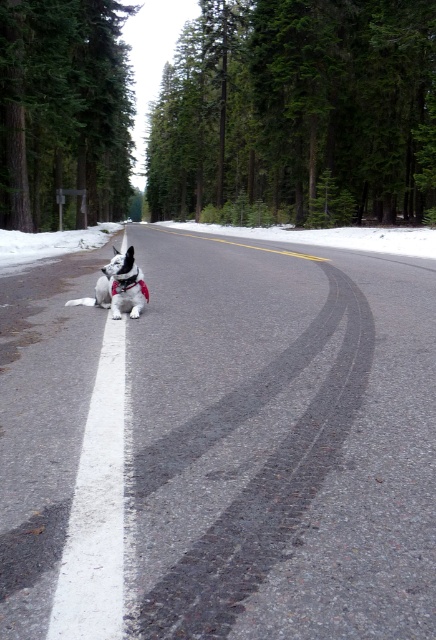
Question: Which of the following is the closest to the observer?

Choices:
 (A) white fur dog at center
 (B) white powdery snow at left
 (C) white powdery snow at road center

Answer: (A)

Question: Which of the following is the closest to the observer?

Choices:
 (A) white powdery snow at road center
 (B) white powdery snow at left

Answer: (B)

Question: Which point is closer to the camera?

Choices:
 (A) white powdery snow at left
 (B) white fur dog at center

Answer: (B)

Question: Does white powdery snow at left have a greater width compared to white fur dog at center?

Choices:
 (A) no
 (B) yes

Answer: (B)

Question: Can you confirm if white powdery snow at road center is positioned to the left of white fur dog at center?

Choices:
 (A) no
 (B) yes

Answer: (A)

Question: Can you confirm if white powdery snow at road center is wider than white fur dog at center?

Choices:
 (A) yes
 (B) no

Answer: (A)